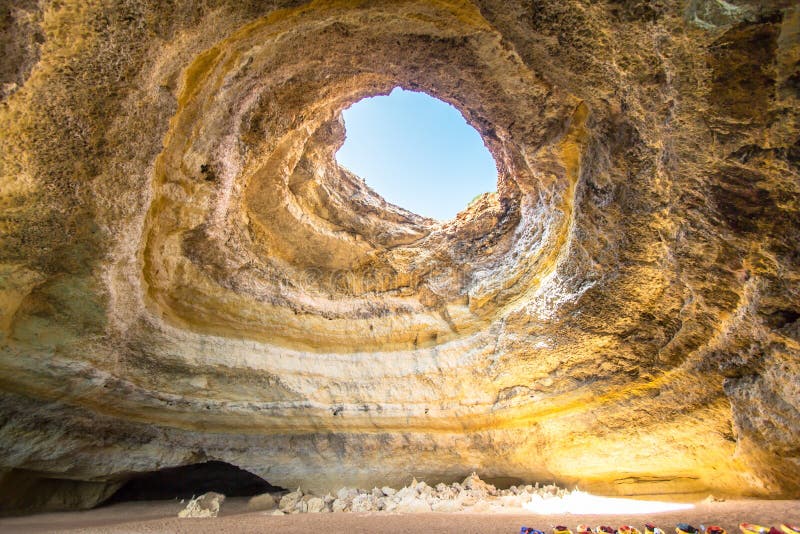
Locate an element on the screen. hole in ceiling is located at coordinates click(x=426, y=513), click(x=409, y=140).